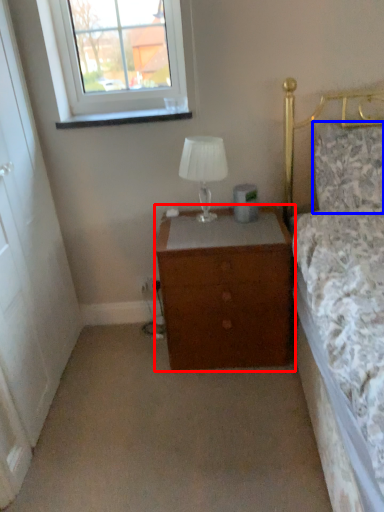
Question: Among these objects, which one is nearest to the camera, chest of drawers (highlighted by a red box) or pillow (highlighted by a blue box)?

Choices:
 (A) chest of drawers
 (B) pillow

Answer: (B)